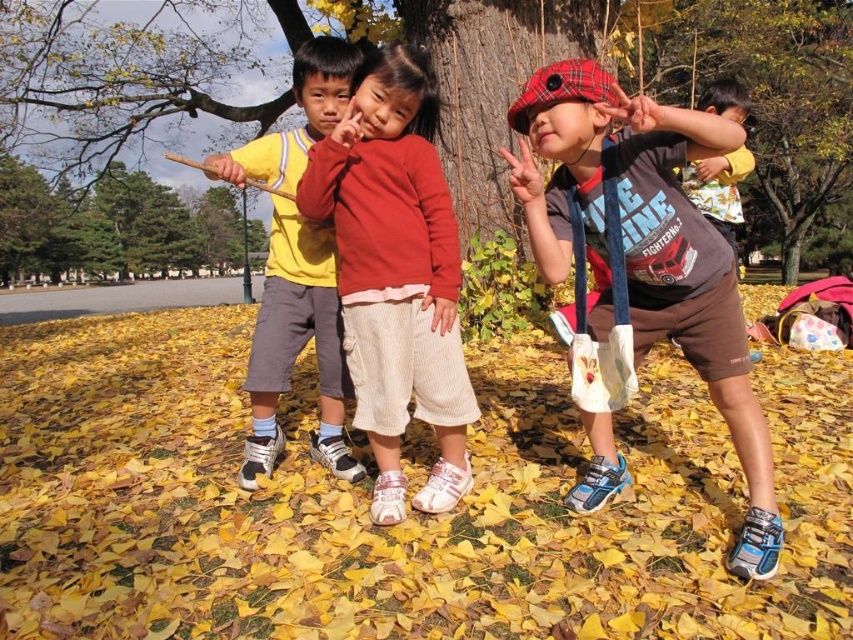
You are a photographer trying to capture the autumn scene with the four children. You notice two points in the image at coordinates point (531, 68) and point (357, 96). Which point is positioned further away from the camera?

Point (531, 68) is behind point (357, 96), so it is further away from the camera.

You are a photographer trying to capture a closeup of the child wearing matte brown shorts at center. The camera you are using has a focus point at coordinate point (650,248). Will this focus point be effective for capturing the child?

Yes, the focus point at point (650,248) will be effective because it is positioned on the matte brown shorts at center, which is part of the child you want to capture.